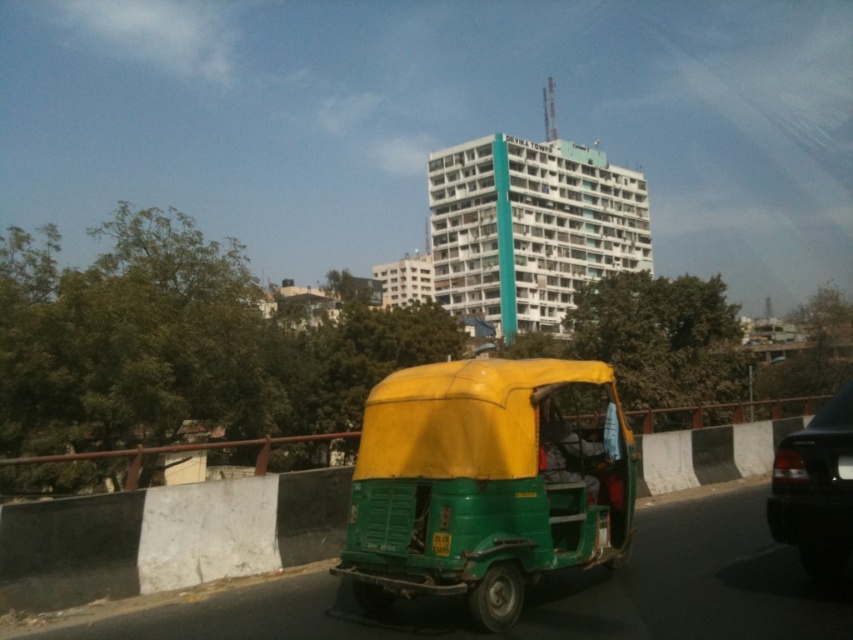
Question: Which point is farther to the camera?

Choices:
 (A) green matte auto-rickshaw at center
 (B) black glossy car at right

Answer: (B)

Question: Which object appears farthest from the camera in this image?

Choices:
 (A) black glossy car at right
 (B) green matte auto-rickshaw at center

Answer: (A)

Question: From the image, what is the correct spatial relationship of green matte auto-rickshaw at center in relation to black glossy car at right?

Choices:
 (A) right
 (B) left

Answer: (B)

Question: Does green matte auto-rickshaw at center have a smaller size compared to black glossy car at right?

Choices:
 (A) no
 (B) yes

Answer: (B)

Question: From the image, what is the correct spatial relationship of green matte auto-rickshaw at center in relation to black glossy car at right?

Choices:
 (A) right
 (B) left

Answer: (B)